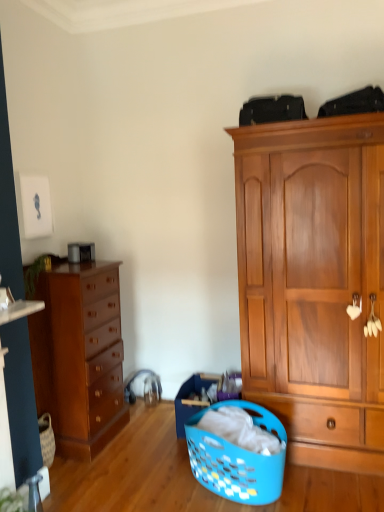
Question: Is wooden cabinet at right a part of shiny brown dresser at left?

Choices:
 (A) yes
 (B) no

Answer: (B)

Question: Can you confirm if shiny brown dresser at left is bigger than wooden cabinet at right?

Choices:
 (A) no
 (B) yes

Answer: (A)

Question: Is shiny brown dresser at left turned away from wooden cabinet at right?

Choices:
 (A) no
 (B) yes

Answer: (A)

Question: From the image's perspective, is shiny brown dresser at left beneath wooden cabinet at right?

Choices:
 (A) no
 (B) yes

Answer: (B)

Question: Could you tell me if shiny brown dresser at left is facing wooden cabinet at right?

Choices:
 (A) no
 (B) yes

Answer: (B)

Question: Is shiny brown dresser at left next to wooden cabinet at right?

Choices:
 (A) no
 (B) yes

Answer: (A)

Question: Is blue plastic laundry basket at lower center completely or partially outside of wooden cabinet at right?

Choices:
 (A) yes
 (B) no

Answer: (A)

Question: From a real-world perspective, is blue plastic laundry basket at lower center physically below wooden cabinet at right?

Choices:
 (A) no
 (B) yes

Answer: (B)

Question: Considering the relative sizes of blue plastic laundry basket at lower center and wooden cabinet at right in the image provided, is blue plastic laundry basket at lower center taller than wooden cabinet at right?

Choices:
 (A) yes
 (B) no

Answer: (B)

Question: Is blue plastic laundry basket at lower center positioned in front of wooden cabinet at right?

Choices:
 (A) no
 (B) yes

Answer: (B)

Question: Can you confirm if blue plastic laundry basket at lower center is smaller than wooden cabinet at right?

Choices:
 (A) no
 (B) yes

Answer: (B)

Question: Considering the relative sizes of blue plastic laundry basket at lower center and wooden cabinet at right in the image provided, is blue plastic laundry basket at lower center wider than wooden cabinet at right?

Choices:
 (A) no
 (B) yes

Answer: (A)

Question: From the image's perspective, is wooden cabinet at right located beneath shiny brown dresser at left?

Choices:
 (A) yes
 (B) no

Answer: (B)